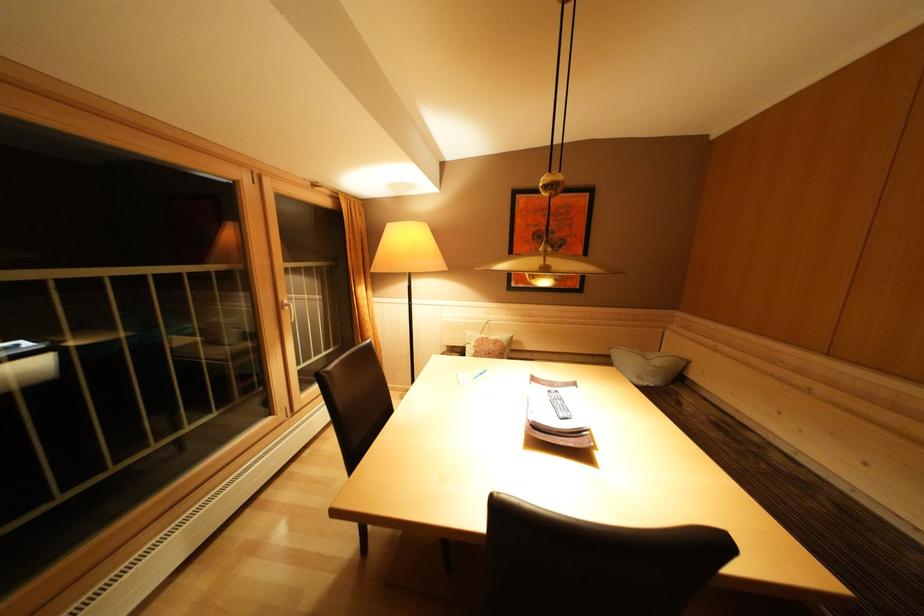
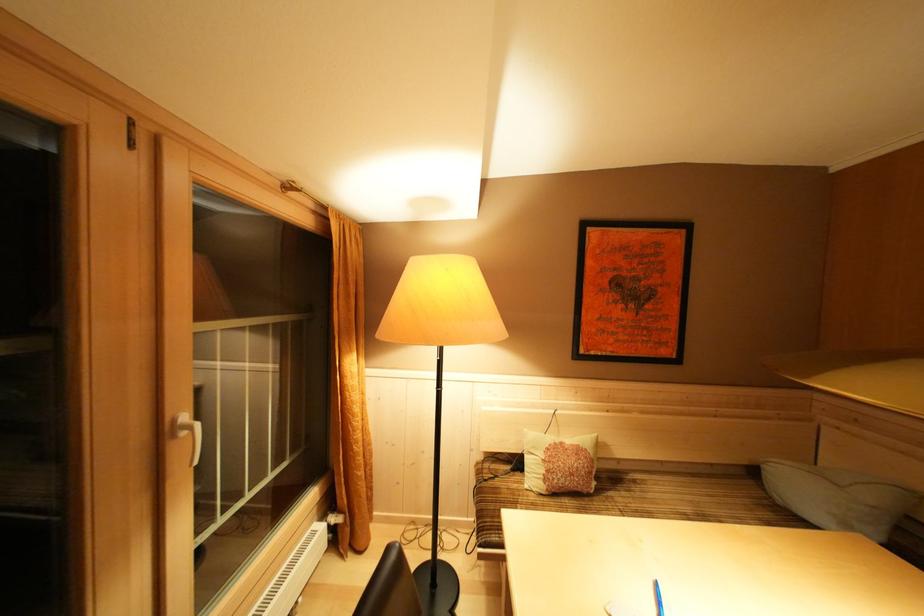
The point at (380, 276) is marked in the first image. Where is the corresponding point in the second image?

(385, 339)